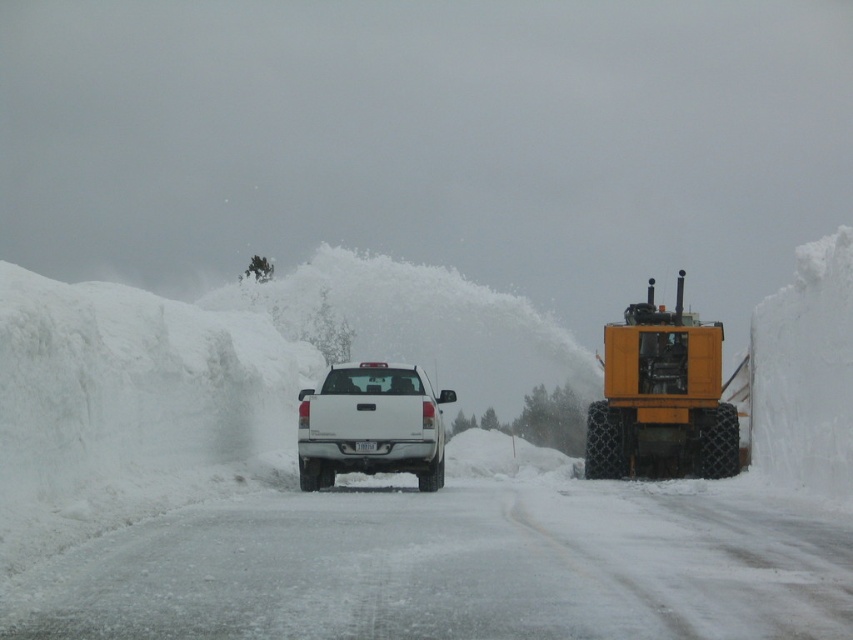
Question: Does white fluffy snow at center appear under white matte truck at center?

Choices:
 (A) no
 (B) yes

Answer: (A)

Question: Which of these objects is positioned farthest from the yellow rubber tractor at right?

Choices:
 (A) white fluffy snow at center
 (B) white matte truck at center

Answer: (A)

Question: Which object is closer to the camera taking this photo?

Choices:
 (A) white matte truck at center
 (B) yellow rubber tractor at right
 (C) white fluffy snow at center

Answer: (C)

Question: Observing the image, what is the correct spatial positioning of yellow rubber tractor at right in reference to white matte truck at center?

Choices:
 (A) right
 (B) left

Answer: (A)

Question: Considering the real-world distances, which object is closest to the white matte truck at center?

Choices:
 (A) yellow rubber tractor at right
 (B) white fluffy snow at center

Answer: (B)

Question: Does white fluffy snow at center have a lesser width compared to yellow rubber tractor at right?

Choices:
 (A) yes
 (B) no

Answer: (B)